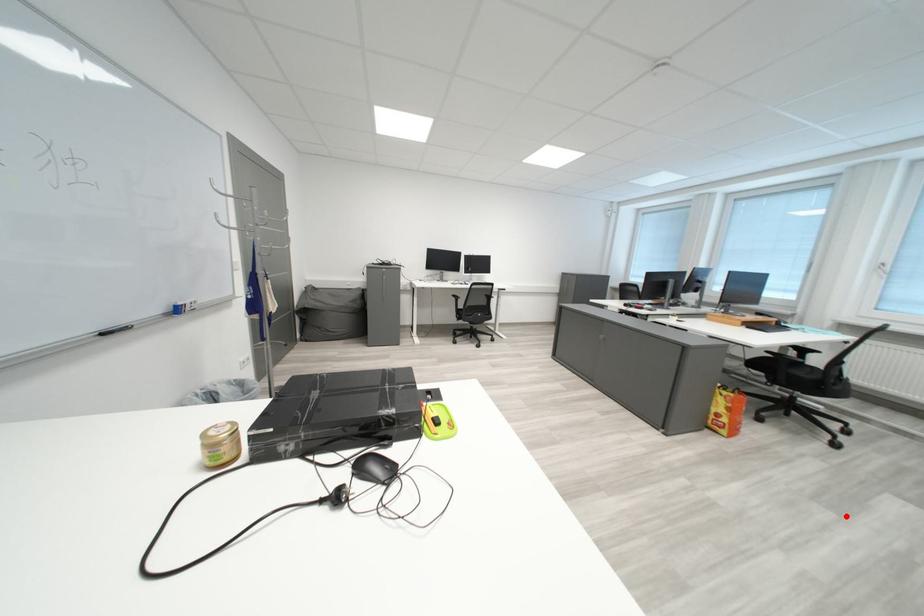
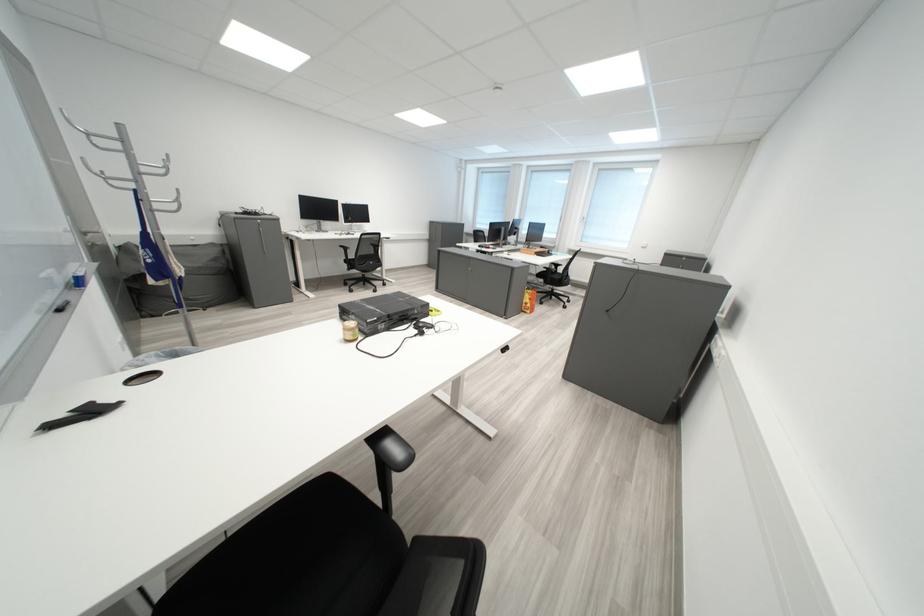
Question: I am providing you with two images of the same scene from different viewpoints. In image1, a red point is highlighted. Considering the same 3D point in image2, which of the following is correct?

Choices:
 (A) It is closer
 (B) It is farther

Answer: (A)